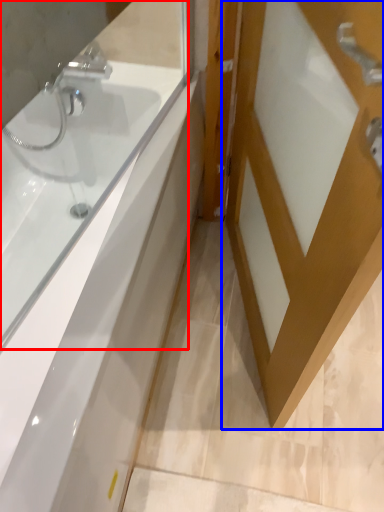
Question: Which object is further to the camera taking this photo, bathtub (highlighted by a red box) or door (highlighted by a blue box)?

Choices:
 (A) bathtub
 (B) door

Answer: (A)